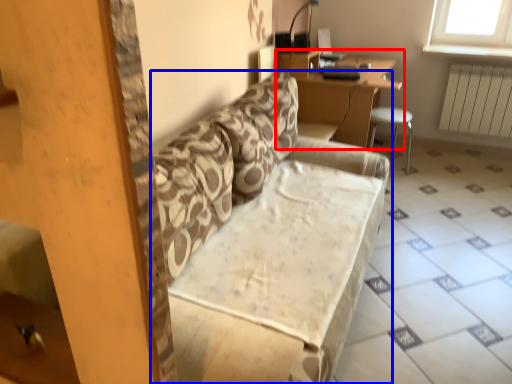
Question: Among these objects, which one is nearest to the camera, table (highlighted by a red box) or studio couch (highlighted by a blue box)?

Choices:
 (A) table
 (B) studio couch

Answer: (B)